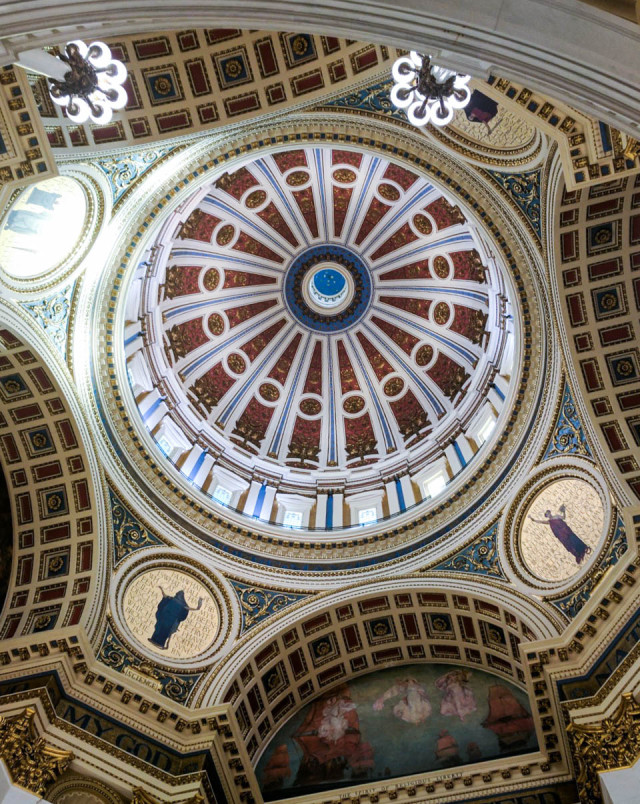
Where is `archways`? archways is located at coordinates (70, 474), (339, 638), (603, 331), (224, 88).